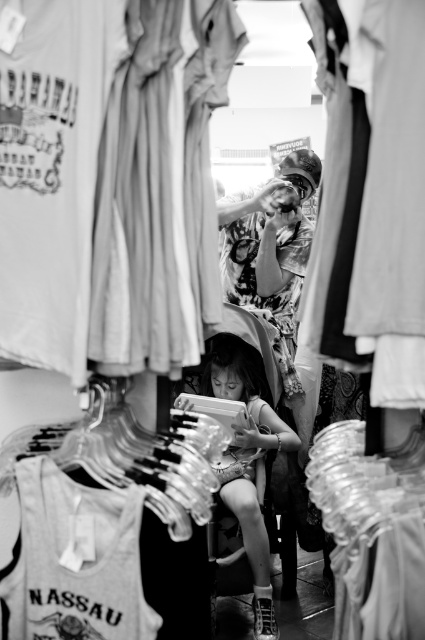
You are a store employee who needs to hand a customer a matte white blouse at center. The customer is the smooth skin child at center. Can you reach the blouse without moving closer than 5 feet?

The matte white blouse at center is 5.95 feet away from the smooth skin child at center. Since the distance is more than 5 feet, you can reach the blouse without moving closer than 5 feet.

You are a store employee who needs to arrange the white cotton tank top at lower left and the printed fabric shirt at center for a display. The store requires that all items in a display must be within 6 feet of each other. Can you place them together in this display?

The white cotton tank top at lower left and printed fabric shirt at center are 7.25 feet apart from each other. Since the store requires items to be within 6 feet for a display, they cannot be placed together in this display as the distance exceeds the limit.